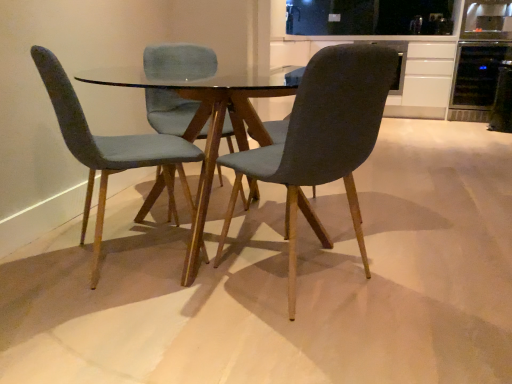
This screenshot has height=384, width=512. What are the coordinates of `free space on the front side of transparent glass table at center` in the screenshot? It's located at (208, 333).